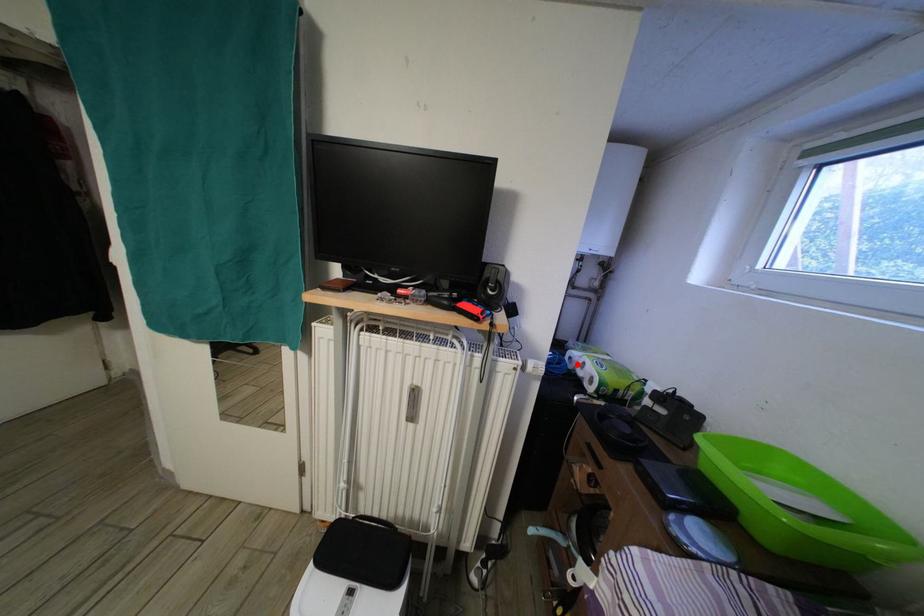
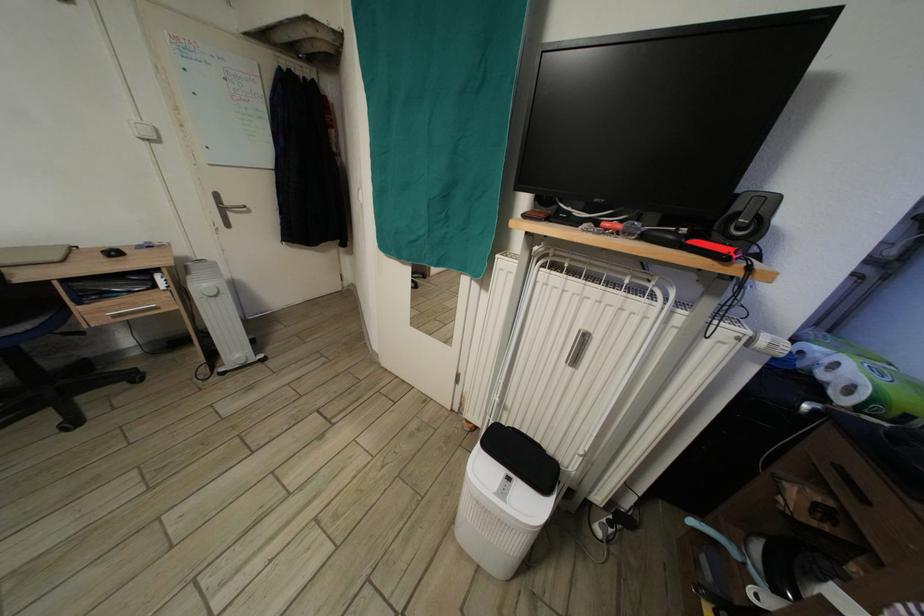
The point at the highlighted location is marked in the first image. Where is the corresponding point in the second image?

(808, 359)